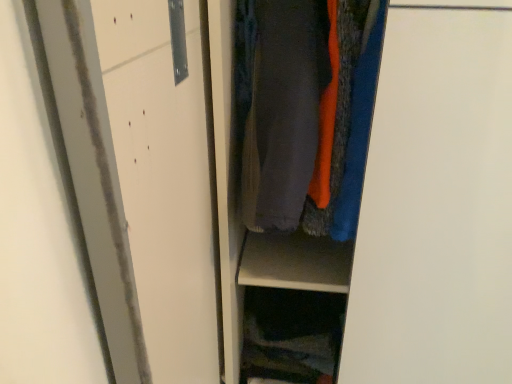
Question: Is dark gray fabric at center in front of or behind dark fabric at lower center in the image?

Choices:
 (A) front
 (B) behind

Answer: (A)

Question: Considering the positions of point (269, 135) and point (331, 329), is point (269, 135) closer or farther from the camera than point (331, 329)?

Choices:
 (A) farther
 (B) closer

Answer: (B)

Question: Looking at their shapes, would you say dark gray fabric at center is wider or thinner than dark fabric at lower center?

Choices:
 (A) wide
 (B) thin

Answer: (A)

Question: From a real-world perspective, is dark fabric at lower center above or below dark gray fabric at center?

Choices:
 (A) below
 (B) above

Answer: (A)

Question: Is dark fabric at lower center inside the boundaries of dark gray fabric at center, or outside?

Choices:
 (A) outside
 (B) inside

Answer: (A)

Question: Is dark fabric at lower center in front of or behind dark gray fabric at center in the image?

Choices:
 (A) behind
 (B) front

Answer: (A)

Question: From the image's perspective, is dark fabric at lower center positioned above or below dark gray fabric at center?

Choices:
 (A) below
 (B) above

Answer: (A)